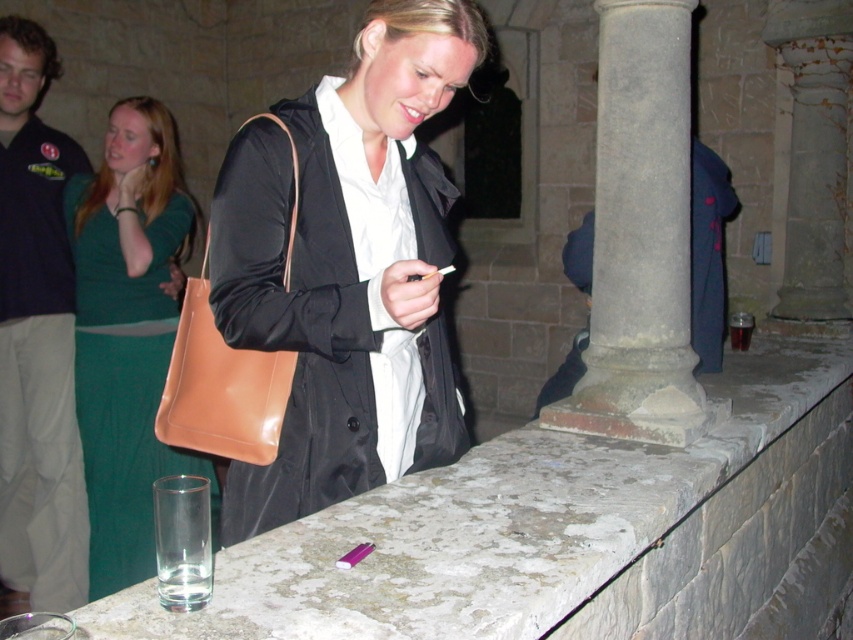
You are a photographer setting up a shoot in this indoor space. You need to position a light source so that it illuminates the matte black coat at center without casting a shadow over the brown leather handbag at center. Given their spatial relationship, is this possible?

The matte black coat at center is in front of the brown leather handbag at center. Therefore, positioning a light source behind the coat would cast a shadow of the coat onto the handbag, making it impossible to avoid the shadow. Alternatively, placing the light directly in front of the coat might minimize shadow overlap, but since the coat is in front, some shadow could still reach the handbag depending on angle. However, the most effective way would be to place the light source to the side where the coat,